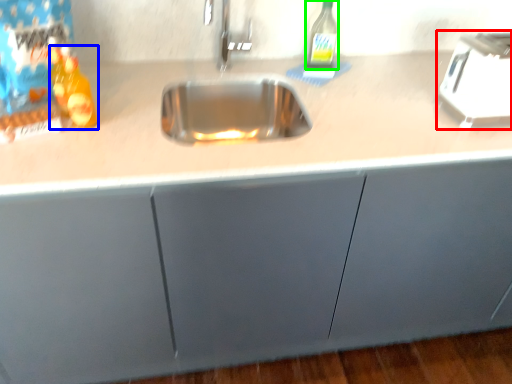
Question: Which is nearer to the appliance (highlighted by a red box)? bottle (highlighted by a blue box) or bottle (highlighted by a green box).

Choices:
 (A) bottle
 (B) bottle

Answer: (B)